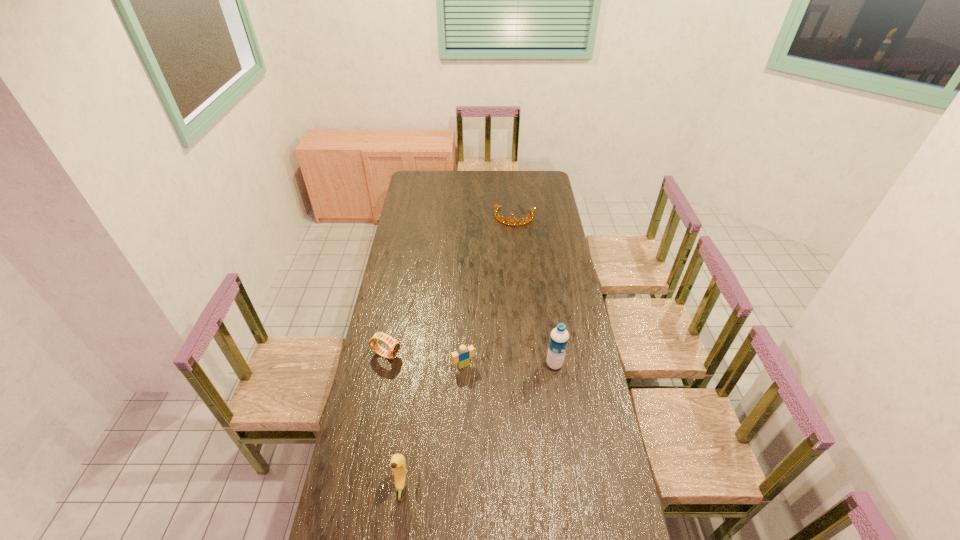
This screenshot has width=960, height=540. In order to click on free space on the desktop that is between the nearest object and the tallest object and is positioned on the front-facing side of the farthest object in this screenshot , I will do `click(466, 435)`.

Find the location of a particular element. This screenshot has width=960, height=540. free spot on the desktop that is between the nearest object and the water bottle and is positioned on the face of the Lego is located at coordinates (492, 415).

Where is `free spot on the desktop that is between the fourth shortest object and the water bottle and is positioned on the face of the watch`? The image size is (960, 540). free spot on the desktop that is between the fourth shortest object and the water bottle and is positioned on the face of the watch is located at coordinates (506, 403).